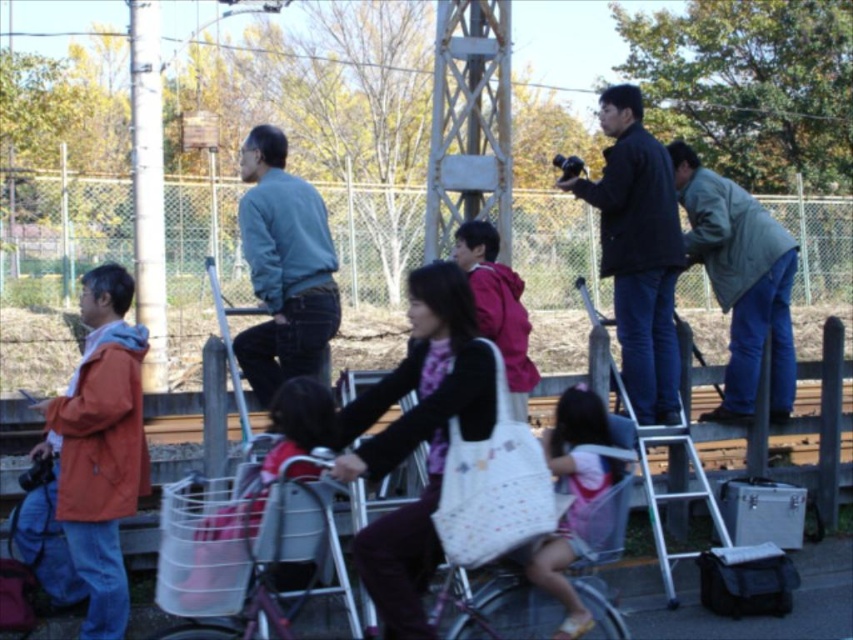
Image resolution: width=853 pixels, height=640 pixels. I want to click on dark blue jacket at center, so click(637, 252).

Is dark blue jacket at center bigger than silver metallic ladder at center?

Correct, dark blue jacket at center is larger in size than silver metallic ladder at center.

Locate an element on the screen. The height and width of the screenshot is (640, 853). dark blue jacket at center is located at coordinates (637, 252).

The height and width of the screenshot is (640, 853). I want to click on dark blue jacket at center, so click(x=637, y=252).

Which is above, pink fabric dress at center or silver metallic ladder at center?

Positioned higher is pink fabric dress at center.

The height and width of the screenshot is (640, 853). What do you see at coordinates (572, 497) in the screenshot? I see `pink fabric dress at center` at bounding box center [572, 497].

Is point (581, 515) closer to camera compared to point (665, 436)?

Yes, point (581, 515) is in front of point (665, 436).

Where is `pink fabric dress at center`? pink fabric dress at center is located at coordinates (572, 497).

Is metallic silver bicycle at center closer to camera compared to teal sweater at center?

Yes, metallic silver bicycle at center is closer to the viewer.

Is metallic silver bicycle at center below teal sweater at center?

Indeed, metallic silver bicycle at center is positioned under teal sweater at center.

What do you see at coordinates (238, 550) in the screenshot? I see `metallic silver bicycle at center` at bounding box center [238, 550].

What are the coordinates of `metallic silver bicycle at center` in the screenshot? It's located at (238, 550).